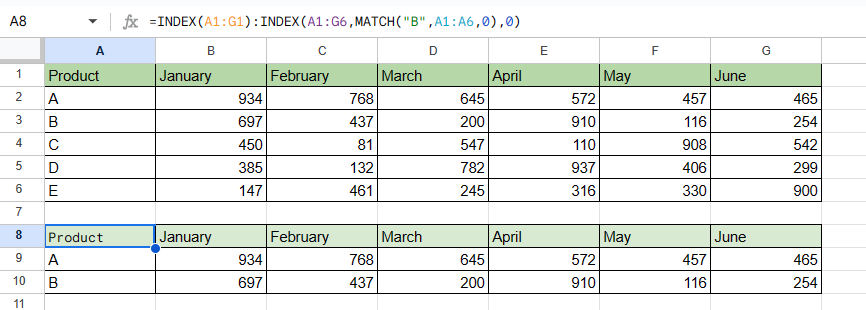
Locate an element on the screen. This screenshot has height=310, width=866. columns is located at coordinates (100, 50), (209, 48), (320, 48), (434, 49), (543, 50), (651, 49), (765, 51), (839, 52).